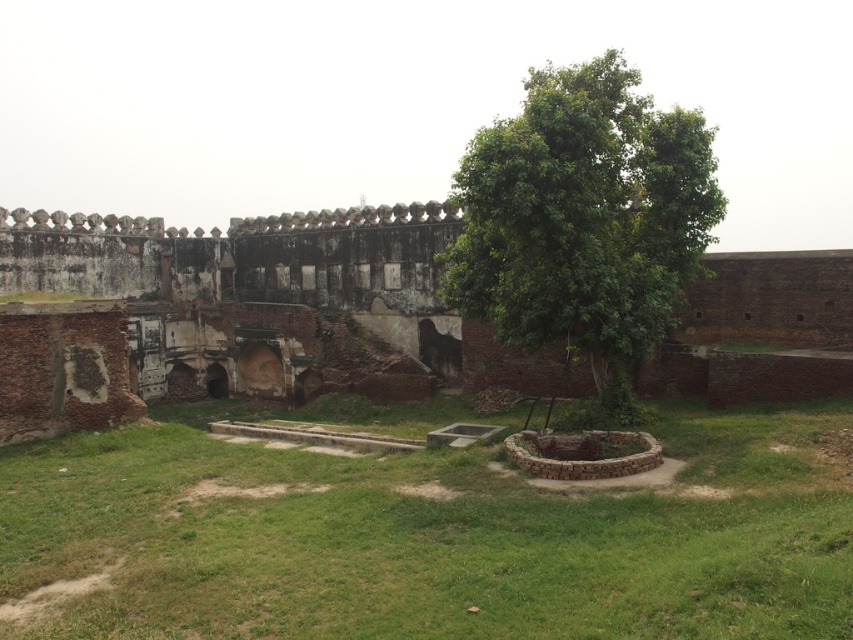
Is point (720, 580) in front of point (612, 67)?

That is True.

Which is in front, point (358, 483) or point (654, 300)?

Point (358, 483) is in front.

Identify the location of green grass at center. (428, 532).

What are the coordinates of `green grass at center` in the screenshot? It's located at (428, 532).

Between green grass at center and weathered brick palace at center, which one has less height?

green grass at center

At what (x,y) coordinates should I click in order to perform the action: click on green grass at center. Please return your answer as a coordinate pair (x, y). The image size is (853, 640). Looking at the image, I should click on (428, 532).

Who is more distant from viewer, (x=277, y=413) or (x=461, y=326)?

The point (x=277, y=413) is more distant.

The height and width of the screenshot is (640, 853). What are the coordinates of `green grass at center` in the screenshot? It's located at (428, 532).

Which is more to the right, weathered brick palace at center or green leafy tree at center?

Positioned to the right is green leafy tree at center.

What do you see at coordinates (276, 300) in the screenshot? The height and width of the screenshot is (640, 853). I see `weathered brick palace at center` at bounding box center [276, 300].

Between point (200, 387) and point (654, 317), which one is positioned in front?

Point (654, 317) is in front.

Locate an element on the screen. Image resolution: width=853 pixels, height=640 pixels. weathered brick palace at center is located at coordinates (276, 300).